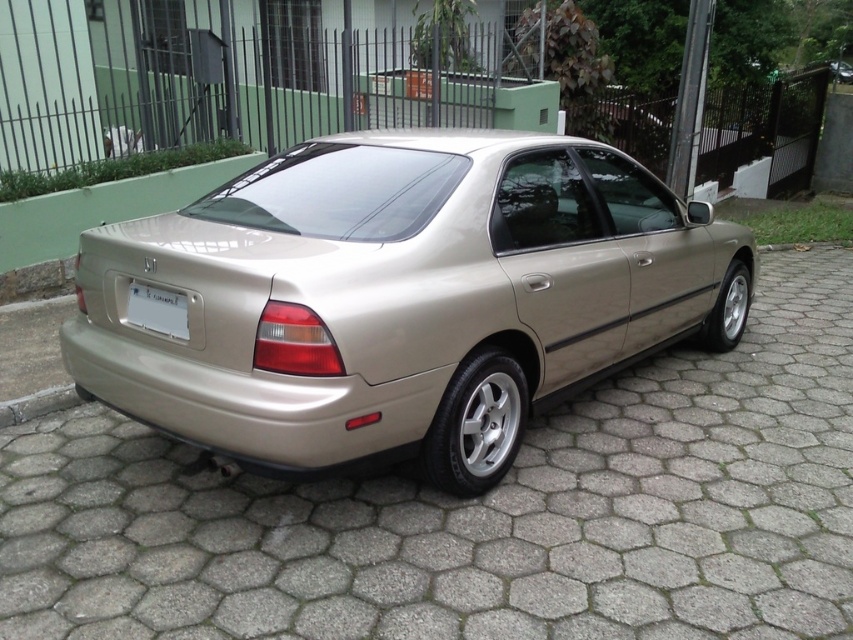
Question: Can you confirm if metallic gold car at center is positioned below metallic gold sedan at center?

Choices:
 (A) yes
 (B) no

Answer: (A)

Question: Which object appears farthest from the camera in this image?

Choices:
 (A) white plastic license plate at center
 (B) gray concrete curb at lower left
 (C) metallic gold car at center
 (D) metallic gold sedan at center

Answer: (B)

Question: Which object is the farthest from the white plastic license plate at center?

Choices:
 (A) gray concrete curb at lower left
 (B) metallic gold sedan at center
 (C) metallic gold car at center

Answer: (A)

Question: Estimate the real-world distances between objects in this image. Which object is farther from the gray concrete curb at lower left?

Choices:
 (A) metallic gold sedan at center
 (B) white plastic license plate at center

Answer: (A)

Question: In this image, where is white plastic license plate at center located relative to gray concrete curb at lower left?

Choices:
 (A) below
 (B) above

Answer: (B)

Question: Does white plastic license plate at center appear over gray concrete curb at lower left?

Choices:
 (A) yes
 (B) no

Answer: (A)